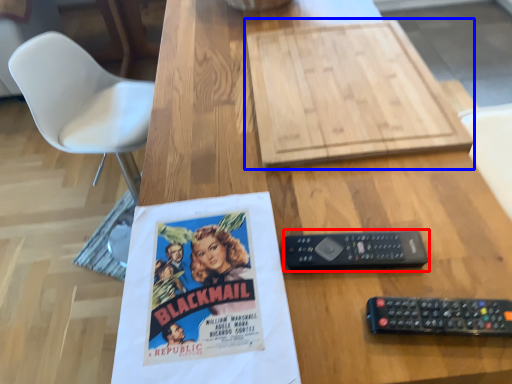
Question: Which of the following is the closest to the observer, control (highlighted by a red box) or cardboard (highlighted by a blue box)?

Choices:
 (A) control
 (B) cardboard

Answer: (A)